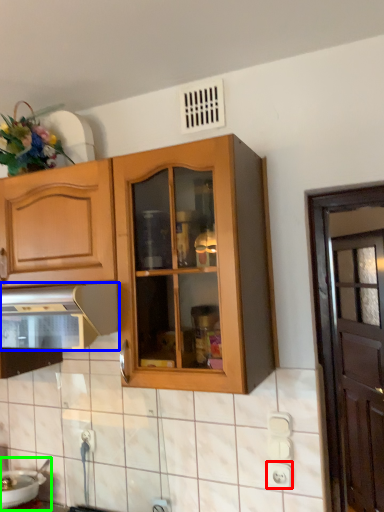
Question: Considering the real-world distances, which object is closest to electric outlet (highlighted by a red box)? kitchen appliance (highlighted by a blue box) or sink (highlighted by a green box).

Choices:
 (A) kitchen appliance
 (B) sink

Answer: (A)